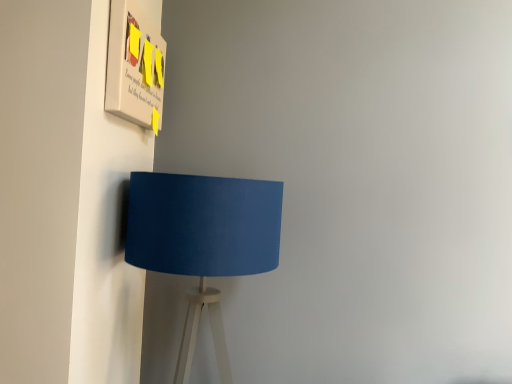
Question: Is matte blue lampshade at lower left located within matte paper poster at upper left?

Choices:
 (A) yes
 (B) no

Answer: (B)

Question: Is matte paper poster at upper left far away from matte blue lampshade at lower left?

Choices:
 (A) yes
 (B) no

Answer: (B)

Question: Can you confirm if matte paper poster at upper left is thinner than matte blue lampshade at lower left?

Choices:
 (A) yes
 (B) no

Answer: (A)

Question: Is matte paper poster at upper left turned away from matte blue lampshade at lower left?

Choices:
 (A) yes
 (B) no

Answer: (B)

Question: Can we say matte paper poster at upper left lies outside matte blue lampshade at lower left?

Choices:
 (A) yes
 (B) no

Answer: (A)

Question: Is matte paper poster at upper left smaller than matte blue lampshade at lower left?

Choices:
 (A) no
 (B) yes

Answer: (B)

Question: From a real-world perspective, is matte blue lampshade at lower left physically above matte paper poster at upper left?

Choices:
 (A) no
 (B) yes

Answer: (A)

Question: Is matte blue lampshade at lower left outside of matte paper poster at upper left?

Choices:
 (A) no
 (B) yes

Answer: (B)

Question: Is matte blue lampshade at lower left at the left side of matte paper poster at upper left?

Choices:
 (A) no
 (B) yes

Answer: (A)

Question: From a real-world perspective, is matte blue lampshade at lower left positioned under matte paper poster at upper left based on gravity?

Choices:
 (A) no
 (B) yes

Answer: (B)

Question: Considering the relative sizes of matte blue lampshade at lower left and matte paper poster at upper left in the image provided, is matte blue lampshade at lower left shorter than matte paper poster at upper left?

Choices:
 (A) yes
 (B) no

Answer: (B)

Question: Can you see matte blue lampshade at lower left touching matte paper poster at upper left?

Choices:
 (A) yes
 (B) no

Answer: (B)

Question: In terms of width, does matte paper poster at upper left look wider or thinner when compared to matte blue lampshade at lower left?

Choices:
 (A) wide
 (B) thin

Answer: (B)